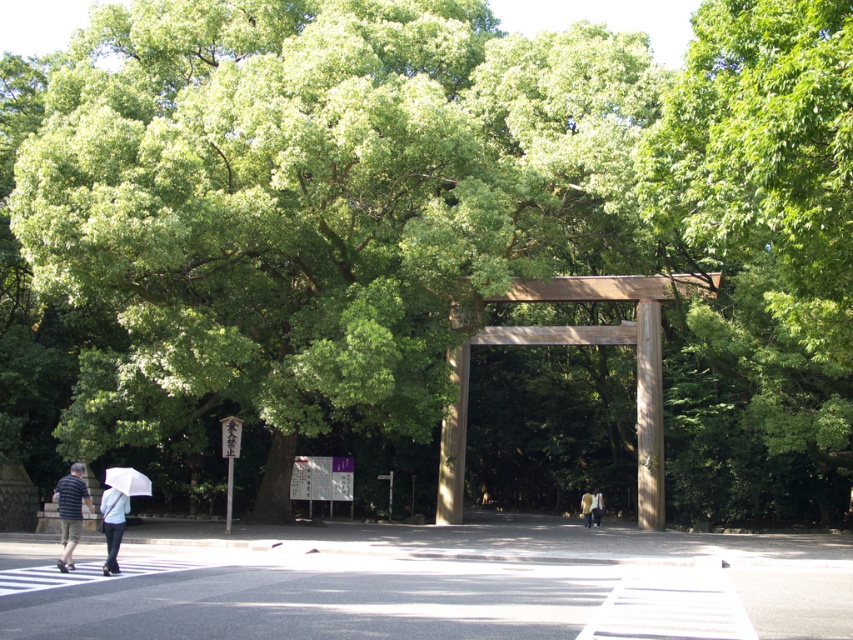
You are a photographer positioned at the torii gate. You want to capture a photo of the striped cotton shirt at lower left and the white matte umbrella at lower left. Since you have a camera with a 50mm lens, which has a field of view that can capture objects up to 36 inches apart in the frame, will both subjects fit in the photo?

The striped cotton shirt at lower left and white matte umbrella at lower left are 39.37 inches apart from each other. Since the camera lens can only capture up to 36 inches, the distance between them exceeds the field of view. Therefore, both subjects will not fit in the photo.